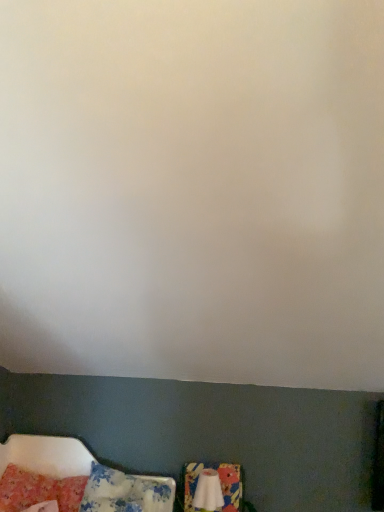
Question: Is white fabric swivel chair at lower center shorter than fluffy pink pillow at lower left, positioned as the second pillow in right-to-left order?

Choices:
 (A) no
 (B) yes

Answer: (A)

Question: Does white fabric swivel chair at lower center have a larger size compared to fluffy pink pillow at lower left, marked as the first pillow in a left-to-right arrangement?

Choices:
 (A) no
 (B) yes

Answer: (A)

Question: Does white fabric swivel chair at lower center appear on the left side of fluffy pink pillow at lower left, positioned as the second pillow in right-to-left order?

Choices:
 (A) no
 (B) yes

Answer: (A)

Question: From the image's perspective, is white fabric swivel chair at lower center below fluffy pink pillow at lower left, marked as the first pillow in a left-to-right arrangement?

Choices:
 (A) yes
 (B) no

Answer: (A)

Question: Considering the relative sizes of white fabric swivel chair at lower center and fluffy pink pillow at lower left, positioned as the second pillow in right-to-left order, in the image provided, is white fabric swivel chair at lower center wider than fluffy pink pillow at lower left, positioned as the second pillow in right-to-left order,?

Choices:
 (A) no
 (B) yes

Answer: (A)

Question: Is white fabric swivel chair at lower center at the right side of fluffy pink pillow at lower left, marked as the first pillow in a left-to-right arrangement?

Choices:
 (A) no
 (B) yes

Answer: (B)

Question: Would you say fluffy pink pillow at lower left, positioned as the second pillow in right-to-left order, contains fluffy cotton pillow at lower left, which is the second pillow from left to right?

Choices:
 (A) no
 (B) yes

Answer: (A)

Question: From a real-world perspective, is fluffy pink pillow at lower left, positioned as the second pillow in right-to-left order, located beneath fluffy cotton pillow at lower left, which is the second pillow from left to right?

Choices:
 (A) yes
 (B) no

Answer: (A)

Question: Can we say fluffy pink pillow at lower left, positioned as the second pillow in right-to-left order, lies outside fluffy cotton pillow at lower left, which is the 1th pillow in right-to-left order?

Choices:
 (A) no
 (B) yes

Answer: (B)

Question: Is fluffy pink pillow at lower left, marked as the first pillow in a left-to-right arrangement, turned away from fluffy cotton pillow at lower left, which is the second pillow from left to right?

Choices:
 (A) yes
 (B) no

Answer: (B)

Question: Is fluffy pink pillow at lower left, positioned as the second pillow in right-to-left order, in front of fluffy cotton pillow at lower left, which is the 1th pillow in right-to-left order?

Choices:
 (A) no
 (B) yes

Answer: (A)

Question: From the image's perspective, is fluffy pink pillow at lower left, marked as the first pillow in a left-to-right arrangement, located above fluffy cotton pillow at lower left, which is the second pillow from left to right?

Choices:
 (A) yes
 (B) no

Answer: (A)

Question: From a real-world perspective, is white fabric swivel chair at lower center on top of fluffy cotton pillow at lower left, which is the 1th pillow in right-to-left order?

Choices:
 (A) yes
 (B) no

Answer: (A)